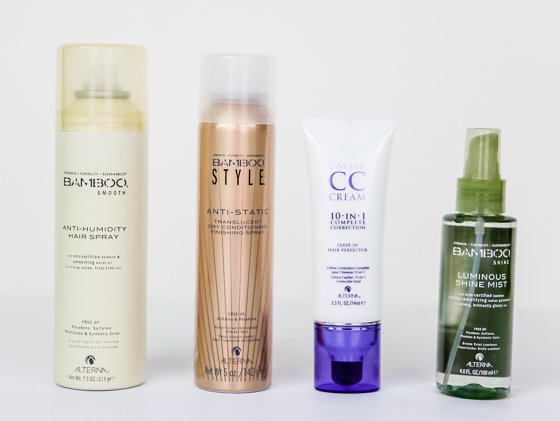
Where is `bottles`? bottles is located at coordinates (99, 231), (245, 218), (360, 225), (466, 260).